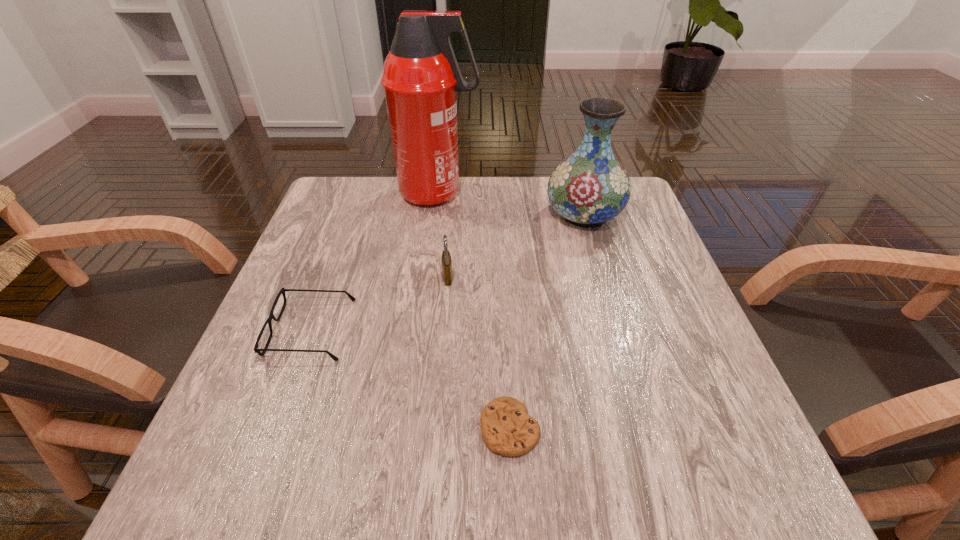
Find the location of `the tallest object`. the tallest object is located at coordinates (421, 75).

The height and width of the screenshot is (540, 960). Find the location of `vase`. vase is located at coordinates point(588,188).

You are a GUI agent. You are given a task and a screenshot of the screen. Output one action in this format:
    pyautogui.click(x=<x>, y=<y>)
    Task: Click on the rightmost object
    The height and width of the screenshot is (540, 960).
    Given the screenshot: What is the action you would take?
    pyautogui.click(x=588, y=188)

Where is `the third farthest object`? the third farthest object is located at coordinates (446, 257).

You are a GUI agent. You are given a task and a screenshot of the screen. Output one action in this format:
    pyautogui.click(x=<x>, y=<y>)
    Task: Click on the third shortest object
    
    Given the screenshot: What is the action you would take?
    pyautogui.click(x=446, y=257)

Where is `the second nearest object`? Image resolution: width=960 pixels, height=540 pixels. the second nearest object is located at coordinates (256, 349).

At what (x,y) coordinates should I click in order to perform the action: click on the leftmost object. Please return your answer as a coordinate pair (x, y). This screenshot has height=540, width=960. Looking at the image, I should click on (256, 349).

What are the coordinates of `the shortest object` in the screenshot? It's located at (506, 428).

Find the location of `cookie`. cookie is located at coordinates (506, 428).

Locate an element on the screen. This screenshot has width=960, height=540. free point located on the trigger side of the tallest object is located at coordinates (531, 193).